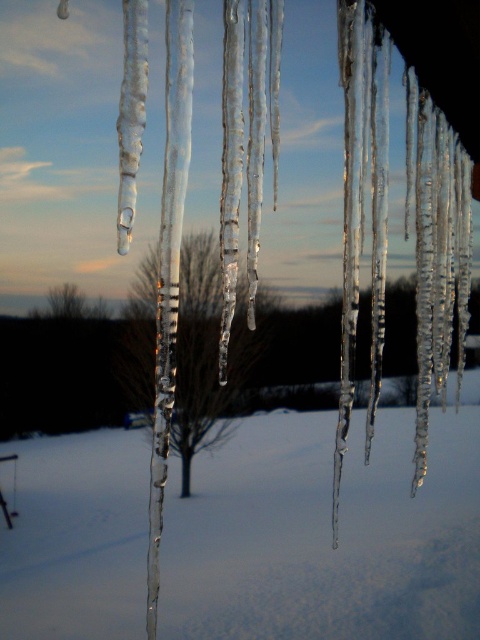
Question: Which of the following is the farthest from the observer?

Choices:
 (A) transparent ice icicles at center
 (B) bare branches at center

Answer: (A)

Question: Does transparent ice icicles at center appear on the right side of bare branches at center?

Choices:
 (A) no
 (B) yes

Answer: (B)

Question: Does transparent ice icicles at center appear over bare branches at center?

Choices:
 (A) yes
 (B) no

Answer: (B)

Question: Which object is closer to the camera taking this photo?

Choices:
 (A) transparent ice icicles at center
 (B) bare branches at center

Answer: (B)

Question: Is transparent ice icicles at center above bare branches at center?

Choices:
 (A) no
 (B) yes

Answer: (A)

Question: Which point appears closest to the camera in this image?

Choices:
 (A) (269, 300)
 (B) (73, 484)

Answer: (B)